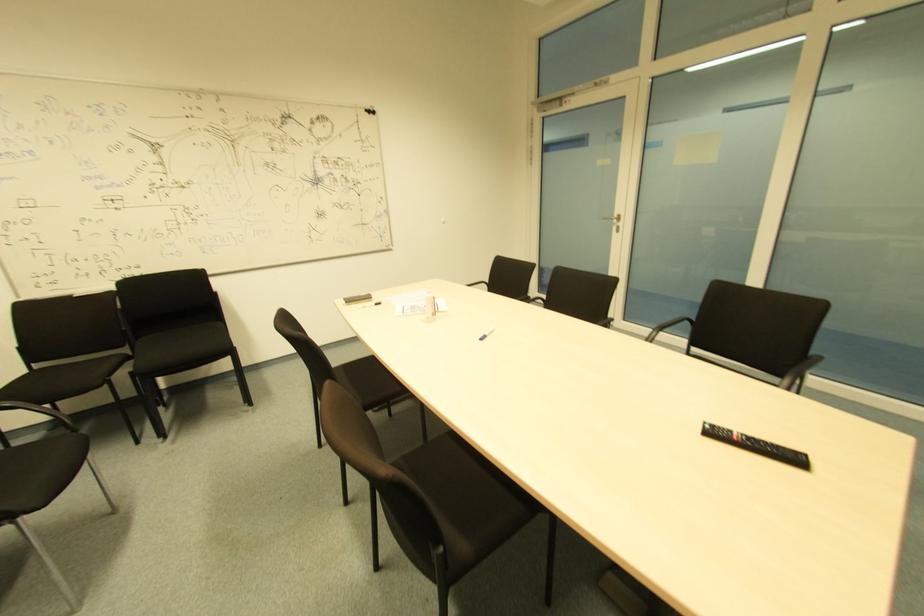
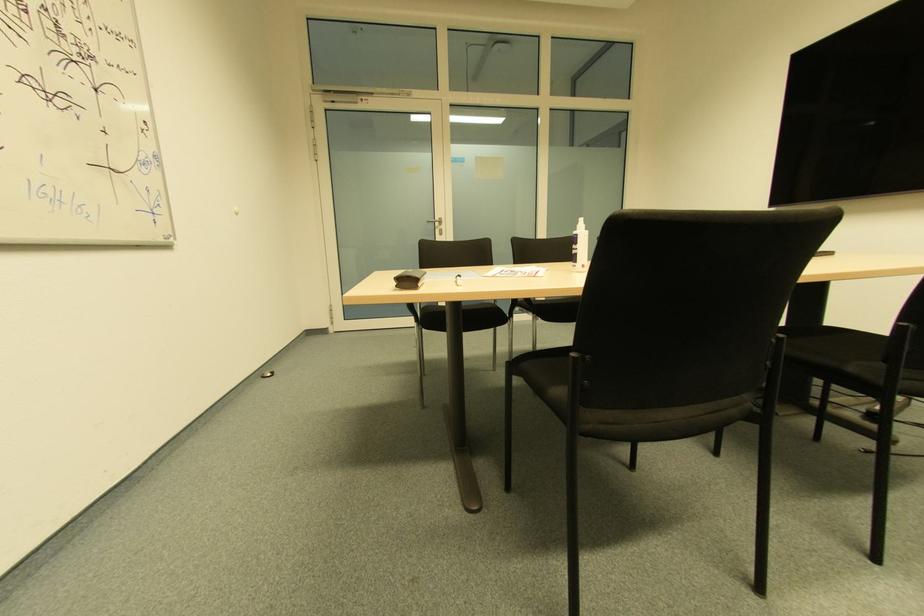
Question: I am providing you with two images of the same scene from different viewpoints. Please identify which objects are invisible in image2.

Choices:
 (A) whiteboard marker
 (B) white marker
 (C) black chair sitting surface
 (D) grey curtain edge

Answer: (A)